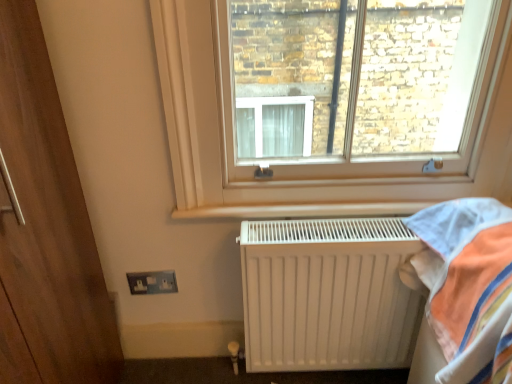
Where is `free spot below white matte radiator at lower right (from a real-world perspective)`? Image resolution: width=512 pixels, height=384 pixels. free spot below white matte radiator at lower right (from a real-world perspective) is located at coordinates (319, 374).